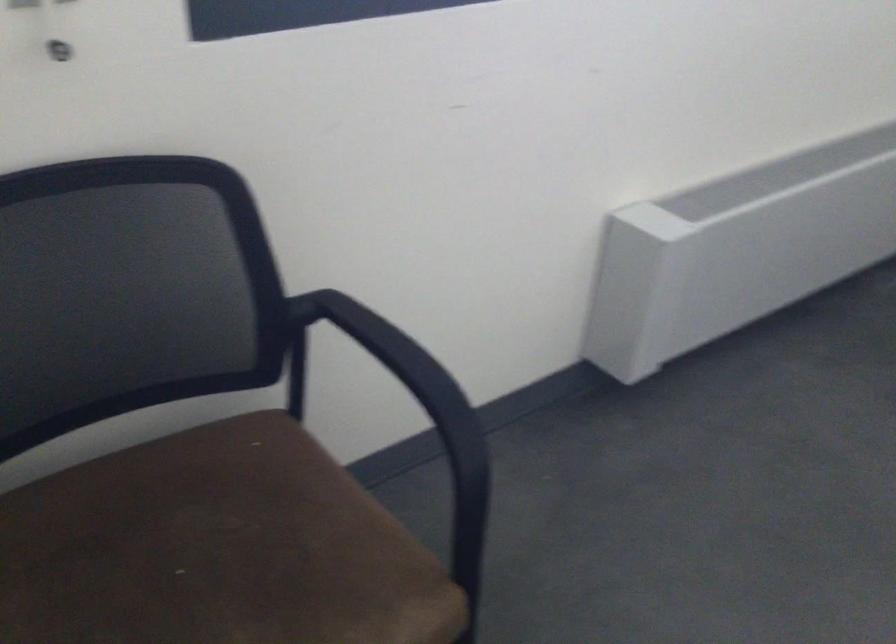
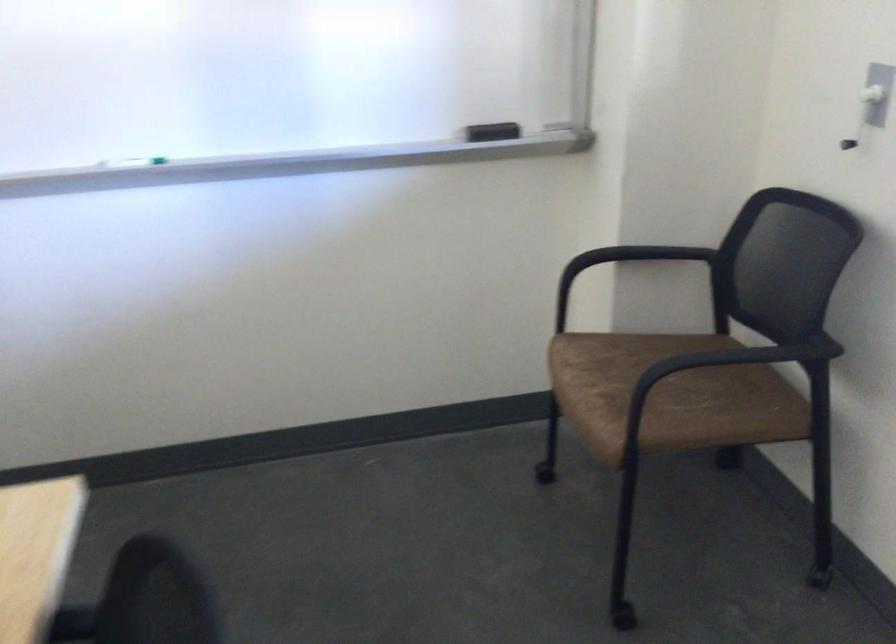
The point at (x=165, y=474) is marked in the first image. Where is the corresponding point in the second image?

(745, 381)